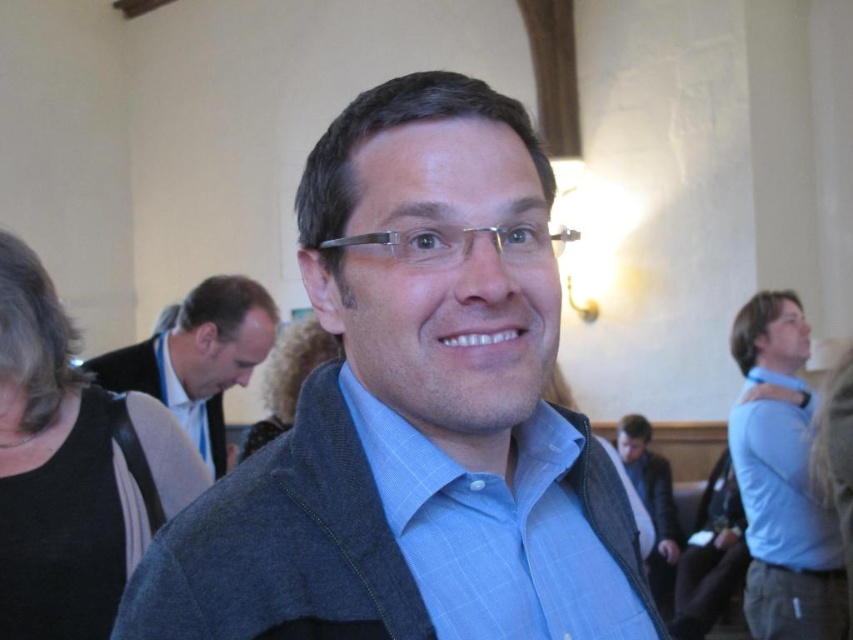
Does blue plaid shirt at center lie in front of blue shirt at right?

Yes, it is.

Is blue plaid shirt at center below blue shirt at right?

Incorrect, blue plaid shirt at center is not positioned below blue shirt at right.

This screenshot has height=640, width=853. Find the location of `blue plaid shirt at center`. blue plaid shirt at center is located at coordinates (496, 532).

The image size is (853, 640). In order to click on blue plaid shirt at center in this screenshot , I will do `click(496, 532)`.

Is blue textured shirt at center below blue plaid shirt at center?

Actually, blue textured shirt at center is above blue plaid shirt at center.

Between point (445, 522) and point (520, 636), which one is positioned behind?

Point (445, 522)

Which is behind, point (409, 470) or point (608, 561)?

The point (608, 561) is more distant.

Find the location of a particular element. This screenshot has width=853, height=640. blue textured shirt at center is located at coordinates (415, 413).

From the picture: Is blue plaid shirt at center shorter than matte black jacket at center?

Indeed, blue plaid shirt at center has a lesser height compared to matte black jacket at center.

Which is in front, point (494, 490) or point (137, 368)?

Point (494, 490)

The width and height of the screenshot is (853, 640). I want to click on blue plaid shirt at center, so click(496, 532).

Identify the location of blue plaid shirt at center. The image size is (853, 640). (496, 532).